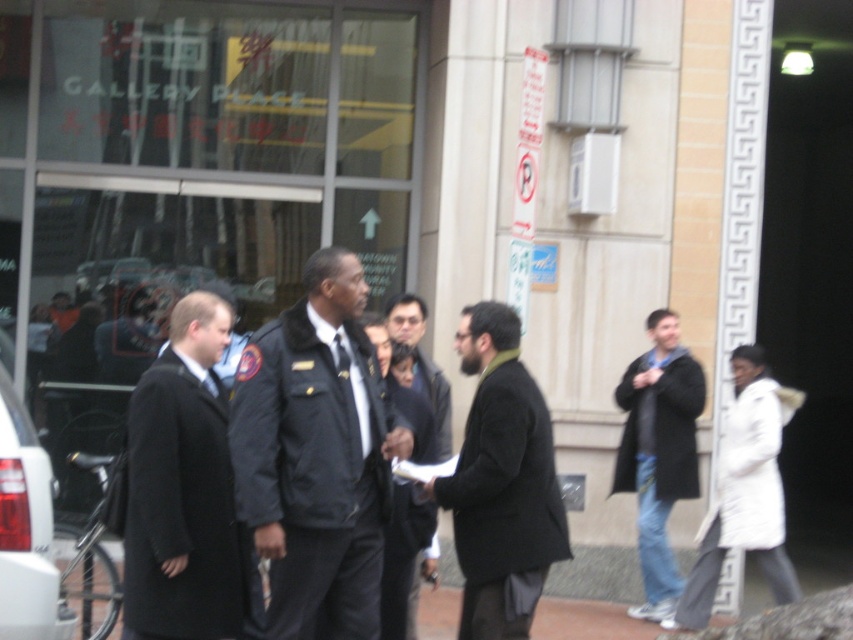
Question: Does matte black car at lower left appear under dark gray uniform at center?

Choices:
 (A) no
 (B) yes

Answer: (B)

Question: Which point is farther from the camera taking this photo?

Choices:
 (A) (534, 403)
 (B) (637, 356)

Answer: (B)

Question: Among these objects, which one is nearest to the camera?

Choices:
 (A) dark blue uniform at center
 (B) black wool coat at center
 (C) black wool coat at left
 (D) matte black car at lower left

Answer: (D)

Question: Which point is closer to the camera?

Choices:
 (A) (39, 570)
 (B) (222, 305)
 (C) (434, 413)

Answer: (A)

Question: Can you confirm if dark blue uniform at center is positioned to the left of black wool coat at center?

Choices:
 (A) yes
 (B) no

Answer: (A)

Question: Observing the image, what is the correct spatial positioning of dark blue jeans at right in reference to dark gray uniform at center?

Choices:
 (A) right
 (B) left

Answer: (A)